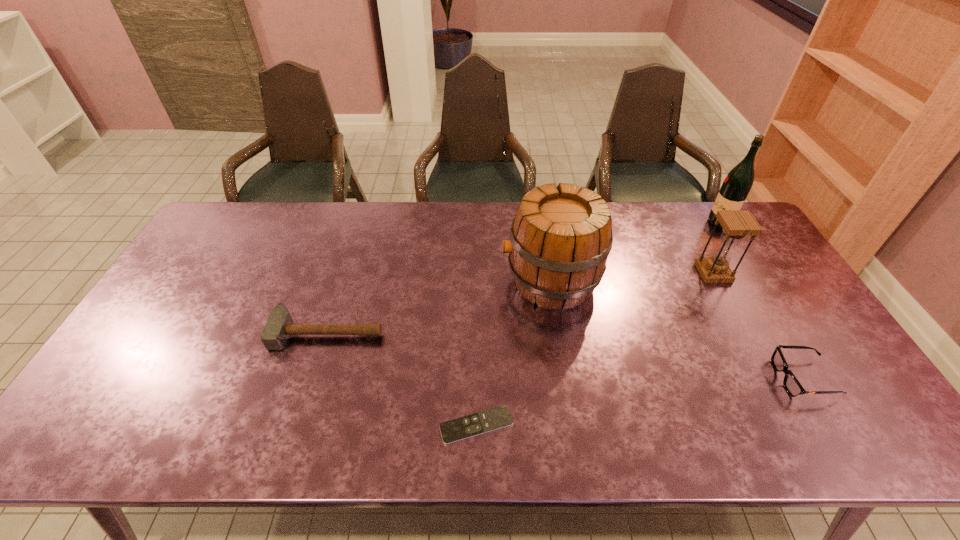
The image size is (960, 540). Identify the location of object at the far edge. (739, 181).

The width and height of the screenshot is (960, 540). Find the location of `object that is at the near edge`. object that is at the near edge is located at coordinates (465, 427).

Find the location of a particular element. This screenshot has width=960, height=540. liquor situated at the right edge is located at coordinates (739, 181).

Where is `hourglass located at the right edge`? The height and width of the screenshot is (540, 960). hourglass located at the right edge is located at coordinates (737, 224).

Locate an element on the screen. sunglasses that is at the right edge is located at coordinates (793, 387).

Find the location of `object positioned at the far right corner`. object positioned at the far right corner is located at coordinates (739, 181).

Locate an element on the screen. free point at the far edge is located at coordinates (660, 242).

Where is `vacant space at the near edge of the desktop`? vacant space at the near edge of the desktop is located at coordinates [x=678, y=428].

I want to click on vacant space at the left edge of the desktop, so click(229, 274).

I want to click on blank space at the right edge of the desktop, so click(x=825, y=349).